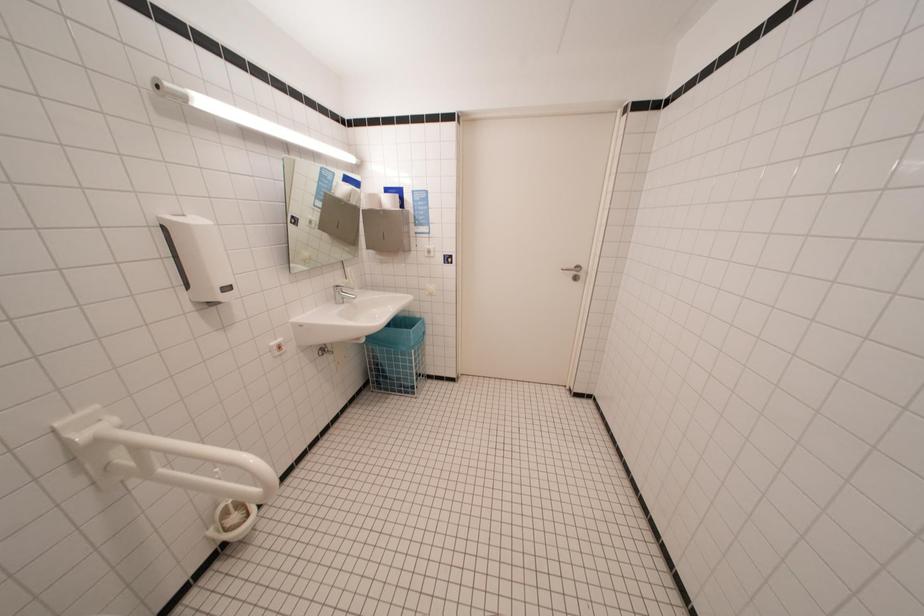
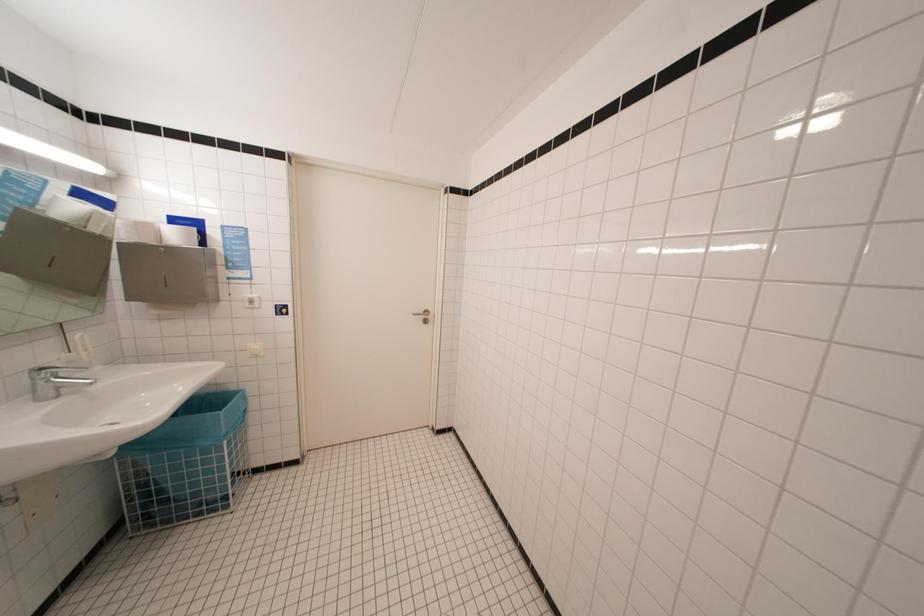
Question: Based on the continuous images, in which direction is the camera rotating? Reply with the corresponding letter.

Choices:
 (A) Left
 (B) Right
 (C) Up
 (D) Down

Answer: (B)